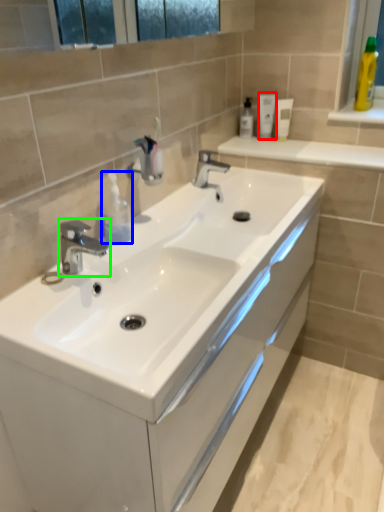
Question: Which object is positioned farthest from mouthwash (highlighted by a red box)? Select from toiletry (highlighted by a blue box) and tap (highlighted by a green box).

Choices:
 (A) toiletry
 (B) tap

Answer: (B)